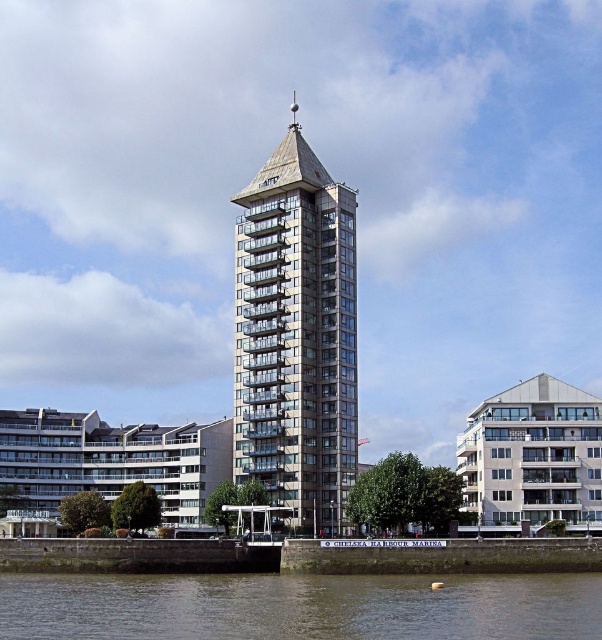
Is the position of metallic glass tower at center less distant than that of brown water at lower center?

No, metallic glass tower at center is behind brown water at lower center.

Does point (308, 225) come closer to viewer compared to point (237, 577)?

No.

Is point (302, 426) positioned after point (346, 595)?

Yes.

You are a GUI agent. You are given a task and a screenshot of the screen. Output one action in this format:
    pyautogui.click(x=<x>, y=<y>)
    Task: Click on the metallic glass tower at center
    
    Given the screenshot: What is the action you would take?
    pyautogui.click(x=296, y=333)